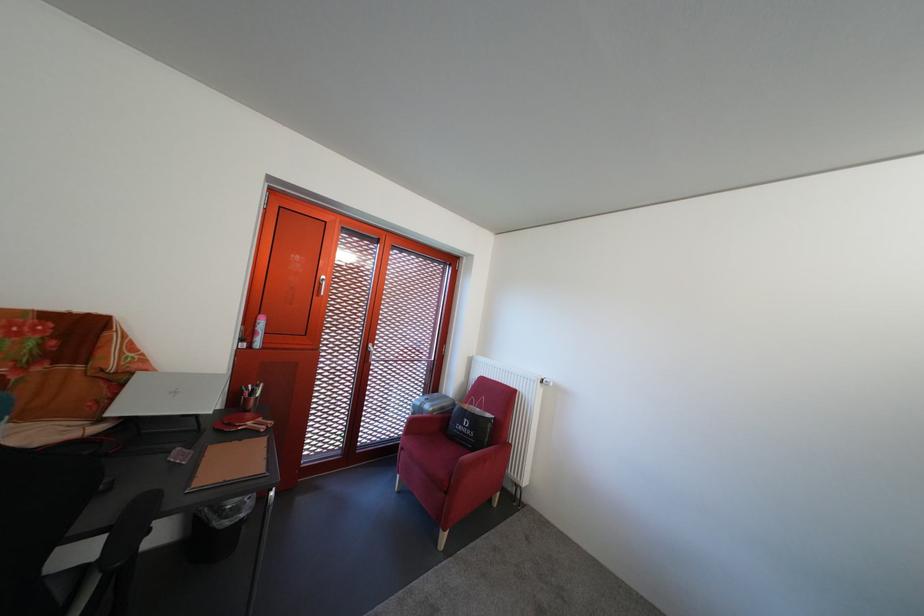
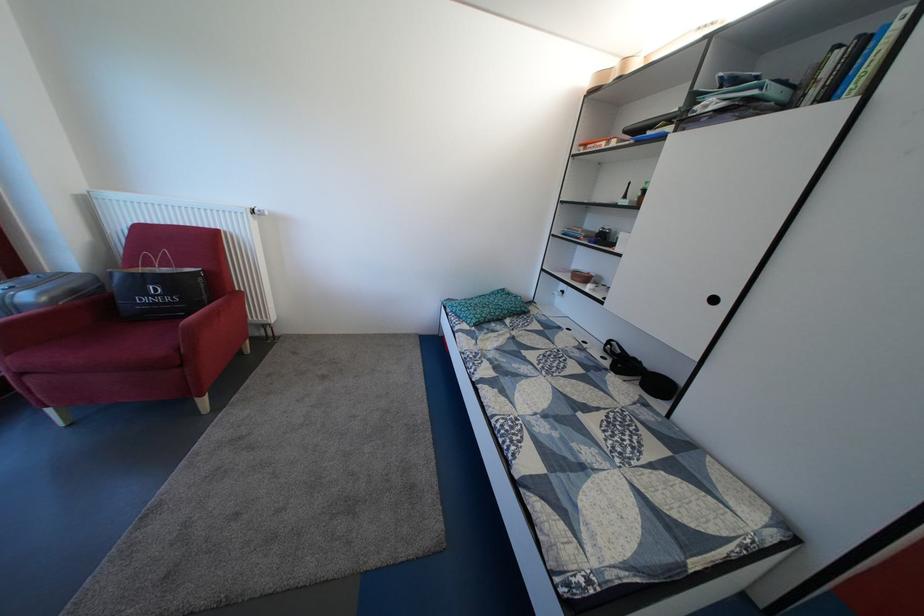
In the second image, find the point that corresponds to point (472, 431) in the first image.

(159, 302)